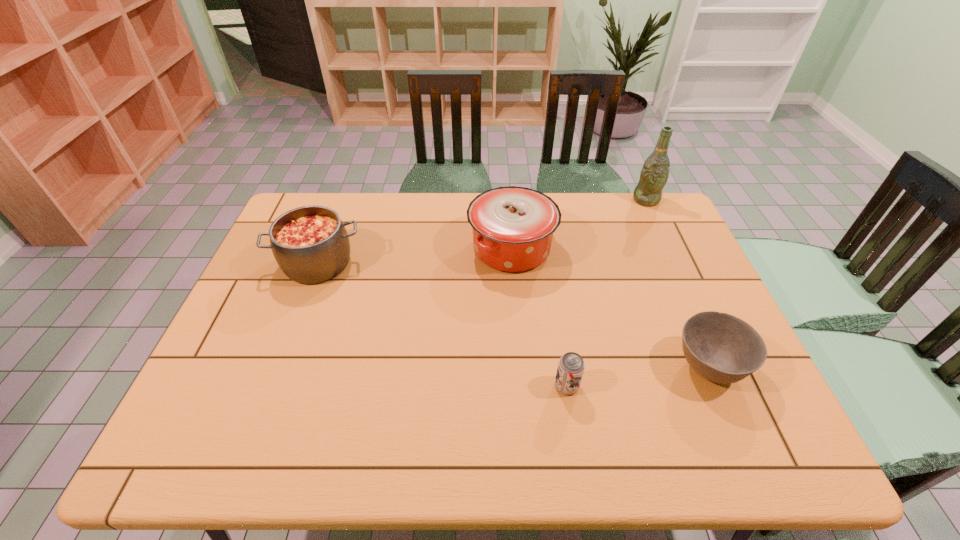
Find the location of `free space that is in between the fourth shortest object and the farthest object`. free space that is in between the fourth shortest object and the farthest object is located at coordinates (579, 224).

You are a GUI agent. You are given a task and a screenshot of the screen. Output one action in this format:
    pyautogui.click(x=<x>, y=<y>)
    Task: Click on the free space between the left casserole and the right casserole
    The image size is (960, 540).
    Given the screenshot: What is the action you would take?
    pyautogui.click(x=415, y=256)

The height and width of the screenshot is (540, 960). Find the location of `free spot between the second tallest object and the bowl`. free spot between the second tallest object and the bowl is located at coordinates (610, 307).

I want to click on empty space between the leftmost object and the bowl, so click(513, 315).

This screenshot has height=540, width=960. In order to click on the closest object to the beer can in this screenshot , I will do `click(721, 348)`.

I want to click on object that is the second closest to the bowl, so click(x=513, y=227).

This screenshot has height=540, width=960. I want to click on vacant region that satisfies the following two spatial constraints: 1. on the front side of the beer can; 2. on the right side of the fourth shortest object, so click(522, 386).

The image size is (960, 540). I want to click on free location that satisfies the following two spatial constraints: 1. on the front side of the shorter casserole; 2. on the right side of the bowl, so click(x=278, y=367).